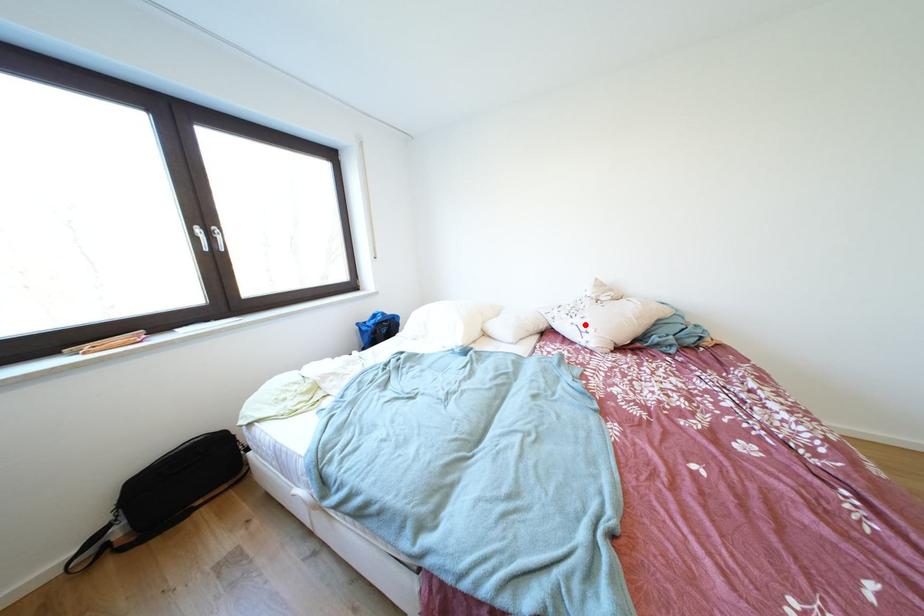
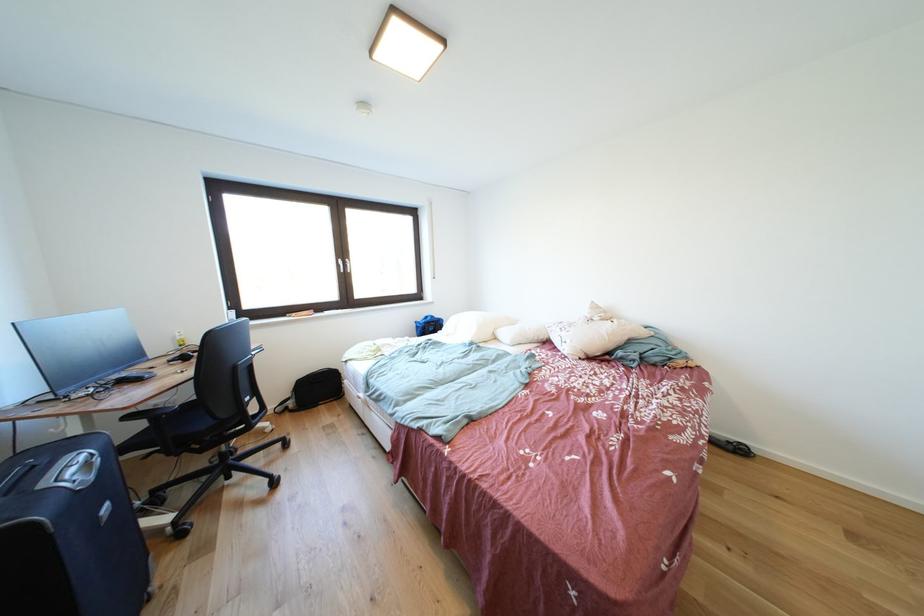
In the second image, find the point that corresponds to the highlighted location in the first image.

(572, 338)